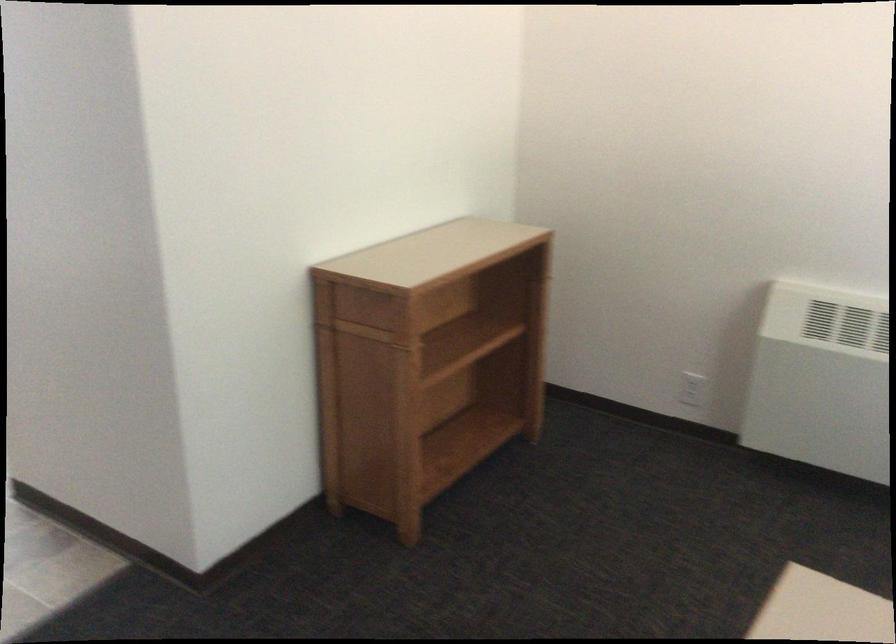
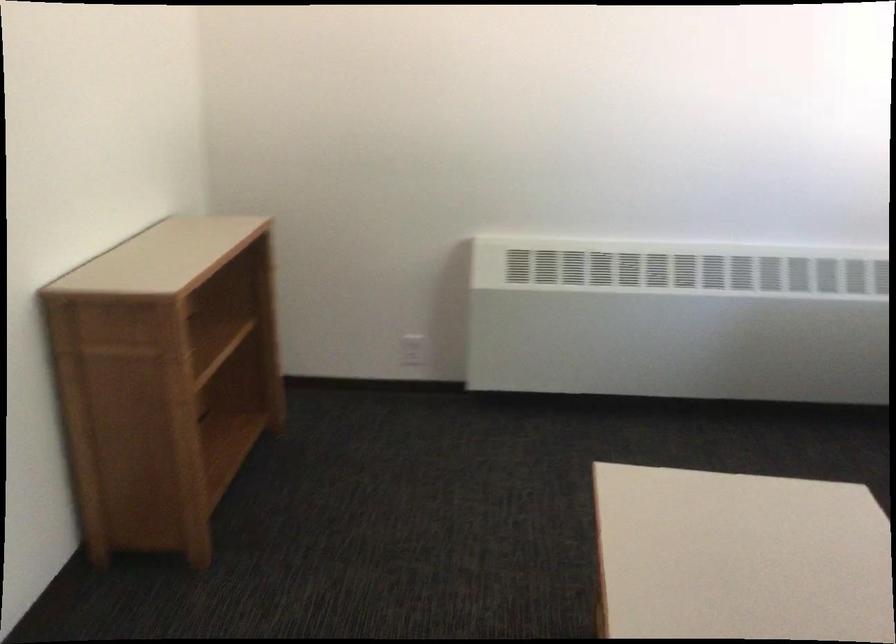
Question: Based on the continuous images, in which direction is the camera rotating? Reply with the corresponding letter.

Choices:
 (A) Left
 (B) Right
 (C) Up
 (D) Down

Answer: (B)